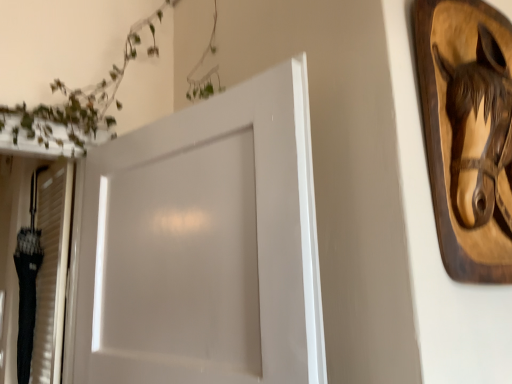
Question: Is white glossy door at center in front of or behind wooden horse head at upper right in the image?

Choices:
 (A) behind
 (B) front

Answer: (B)

Question: In terms of height, does white glossy door at center look taller or shorter compared to wooden horse head at upper right?

Choices:
 (A) short
 (B) tall

Answer: (B)

Question: Based on their positions, is white glossy door at center located to the left or right of wooden horse head at upper right?

Choices:
 (A) left
 (B) right

Answer: (A)

Question: From the image's perspective, relative to white glossy door at center, is wooden horse head at upper right above or below?

Choices:
 (A) below
 (B) above

Answer: (B)

Question: Considering the positions of point (434, 51) and point (105, 162), is point (434, 51) closer or farther from the camera than point (105, 162)?

Choices:
 (A) closer
 (B) farther

Answer: (A)

Question: In terms of height, does wooden horse head at upper right look taller or shorter compared to white glossy door at center?

Choices:
 (A) short
 (B) tall

Answer: (A)

Question: Relative to white glossy door at center, is wooden horse head at upper right in front or behind?

Choices:
 (A) front
 (B) behind

Answer: (B)